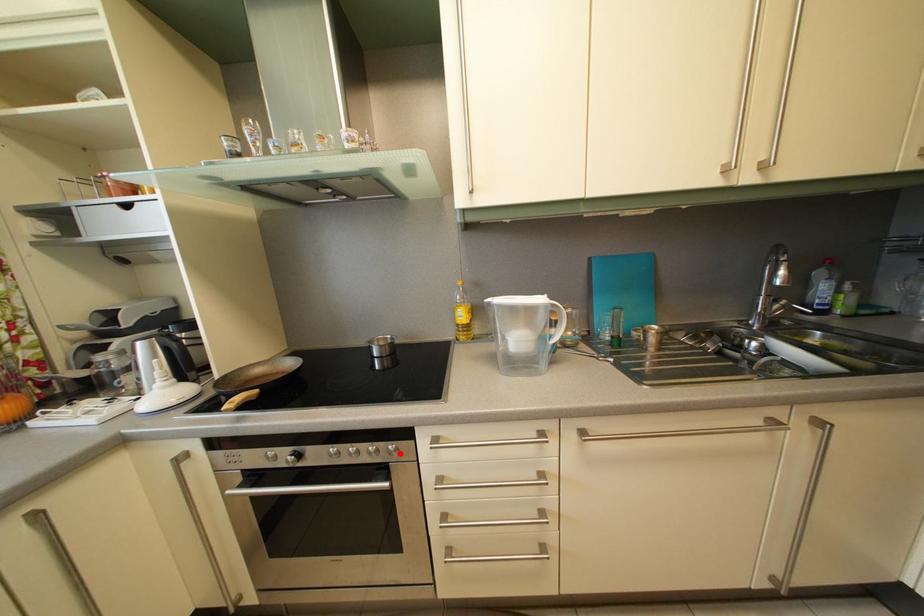
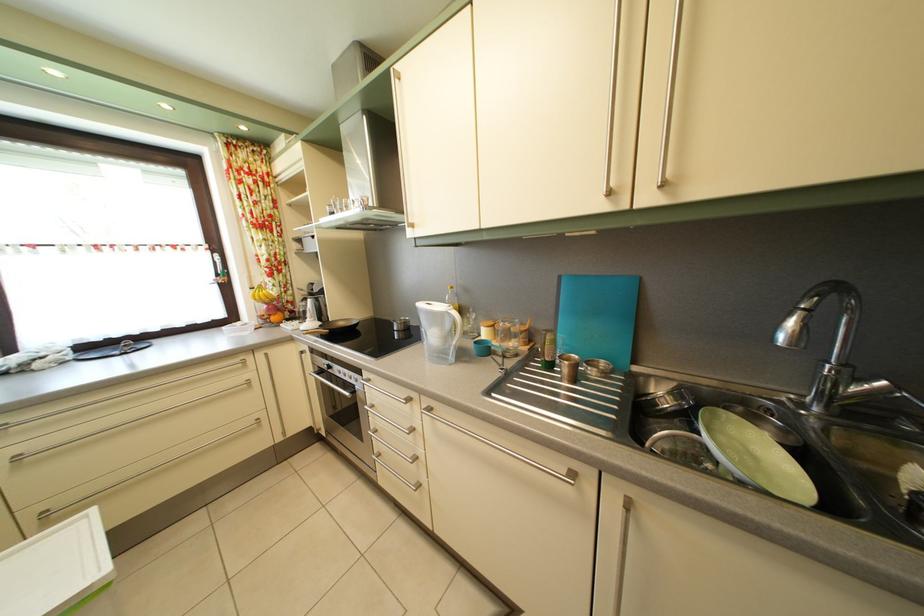
Question: I am providing you with two images of the same scene from different viewpoints. A red point is marked on the first image. Is the red point's position out of view in image 2?

Choices:
 (A) Yes
 (B) No

Answer: (B)